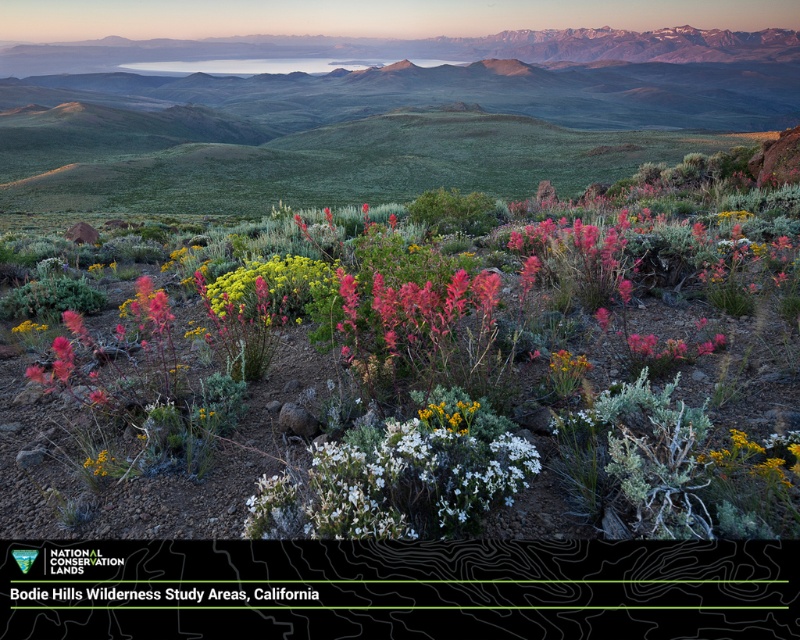
You are an artist planning to paint the landscape. You want to ensure the green grassy mountain range at upper center and the vivid crimson petals at center are proportionally accurate. Which of the two should you make wider in your painting?

The green grassy mountain range at upper center should be made wider in the painting since its width is larger than that of the vivid crimson petals at center according to the description.

From the picture: You are standing in the landscape and want to take a photo of the green grassy mountain range at upper center and the green leafy plant at center. Which object should you focus on first if you want both to be in sharp focus?

The green grassy mountain range at upper center is above the green leafy plant at center, so you should focus on the green leafy plant at center first to ensure both are in sharp focus.

You are standing in the landscape and want to take a photo of the green grassy mountain range at upper center and the vivid crimson petals at center. If you want the mountain range to appear to the left of the petals in your photo, should you adjust your position to the right or left of the current spot?

You should adjust your position to the left. The green grassy mountain range at upper center is already positioned on the left side of the vivid crimson petals at center. By moving to the left, you can ensure the mountain range stays to the left of the petals in the photo.